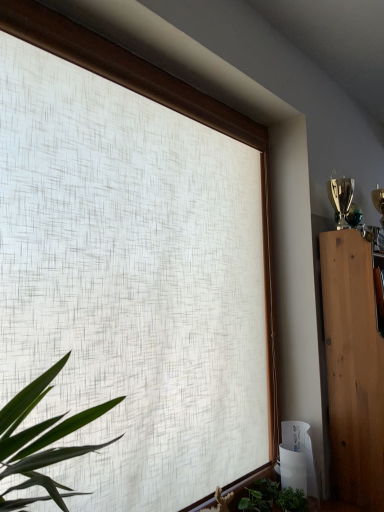
Question: Does light brown wood cabinet at right appear on the left side of green leafy plant at lower center?

Choices:
 (A) no
 (B) yes

Answer: (A)

Question: From the image's perspective, does light brown wood cabinet at right appear lower than green leafy plant at lower center?

Choices:
 (A) no
 (B) yes

Answer: (A)

Question: Can you confirm if light brown wood cabinet at right is smaller than green leafy plant at lower center?

Choices:
 (A) yes
 (B) no

Answer: (B)

Question: From the image's perspective, is light brown wood cabinet at right on top of green leafy plant at lower center?

Choices:
 (A) no
 (B) yes

Answer: (B)

Question: Could you tell me if light brown wood cabinet at right is facing green leafy plant at lower center?

Choices:
 (A) no
 (B) yes

Answer: (A)

Question: From a real-world perspective, is light brown wood cabinet at right physically located above or below green matte plant at lower right?

Choices:
 (A) below
 (B) above

Answer: (B)

Question: Relative to green matte plant at lower right, is light brown wood cabinet at right in front or behind?

Choices:
 (A) behind
 (B) front

Answer: (A)

Question: Based on their positions, is light brown wood cabinet at right located to the left or right of green matte plant at lower right?

Choices:
 (A) left
 (B) right

Answer: (B)

Question: Considering the positions of point (367, 289) and point (291, 508), is point (367, 289) closer or farther from the camera than point (291, 508)?

Choices:
 (A) farther
 (B) closer

Answer: (A)

Question: Considering the positions of green matte plant at lower right and light brown wood cabinet at right in the image, is green matte plant at lower right wider or thinner than light brown wood cabinet at right?

Choices:
 (A) thin
 (B) wide

Answer: (A)

Question: From the image's perspective, relative to light brown wood cabinet at right, is green matte plant at lower right above or below?

Choices:
 (A) above
 (B) below

Answer: (B)

Question: Based on their positions, is green matte plant at lower right located to the left or right of light brown wood cabinet at right?

Choices:
 (A) left
 (B) right

Answer: (A)

Question: From a real-world perspective, relative to light brown wood cabinet at right, is green matte plant at lower right vertically above or below?

Choices:
 (A) below
 (B) above

Answer: (A)

Question: Is green matte plant at lower right to the left or to the right of green leafy plant at lower center in the image?

Choices:
 (A) left
 (B) right

Answer: (B)

Question: In the image, is green matte plant at lower right positioned in front of or behind green leafy plant at lower center?

Choices:
 (A) behind
 (B) front

Answer: (B)